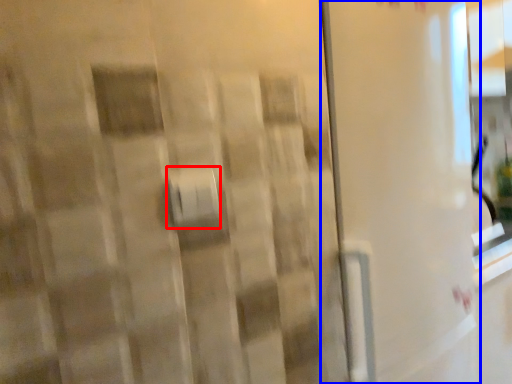
Question: Among these objects, which one is farthest to the camera, towel bar (highlighted by a red box) or screen door (highlighted by a blue box)?

Choices:
 (A) towel bar
 (B) screen door

Answer: (B)